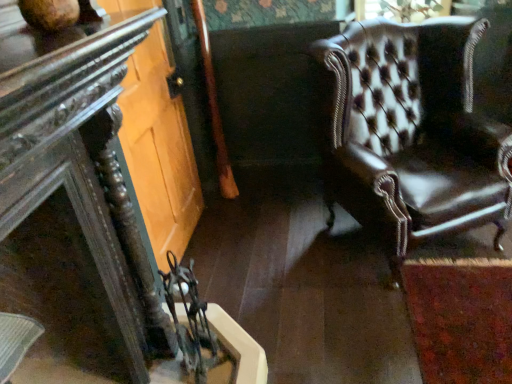
The width and height of the screenshot is (512, 384). Find the location of `clear glass door at lower left`. clear glass door at lower left is located at coordinates (159, 149).

Can you confirm if dark wood table at left is shorter than leather armchair at right?

Yes, dark wood table at left is shorter than leather armchair at right.

Is point (24, 107) closer to camera compared to point (435, 193)?

Yes.

Is dark wood table at left positioned beyond the bounds of leather armchair at right?

That's correct, dark wood table at left is outside of leather armchair at right.

Which is closer to the camera, (163,116) or (331,110)?

The point (331,110) is closer to the camera.

Would you say clear glass door at lower left is inside or outside leather armchair at right?

clear glass door at lower left is located beyond the bounds of leather armchair at right.

In the scene shown: Is clear glass door at lower left positioned in front of leather armchair at right?

Yes.

Is clear glass door at lower left at the right side of leather armchair at right?

Incorrect, clear glass door at lower left is not on the right side of leather armchair at right.

Which of these two, leather armchair at right or clear glass door at lower left, stands taller?

clear glass door at lower left.

Considering the positions of objects leather armchair at right and clear glass door at lower left in the image provided, who is behind, leather armchair at right or clear glass door at lower left?

leather armchair at right is behind.

Considering the sizes of objects leather armchair at right and clear glass door at lower left in the image provided, who is wider, leather armchair at right or clear glass door at lower left?

Wider between the two is leather armchair at right.

From a real-world perspective, is leather armchair at right positioned under clear glass door at lower left based on gravity?

Yes.

Would you say leather armchair at right is a long distance from dark wood table at left?

leather armchair at right is far away from dark wood table at left.

Is point (373, 48) positioned before point (17, 95)?

No, (373, 48) is behind (17, 95).

Where is `table above the leather armchair at right (from a real-world perspective)`? This screenshot has height=384, width=512. table above the leather armchair at right (from a real-world perspective) is located at coordinates (82, 170).

Considering the relative sizes of leather armchair at right and dark wood table at left in the image provided, is leather armchair at right shorter than dark wood table at left?

No.

You are a GUI agent. You are given a task and a screenshot of the screen. Output one action in this format:
    pyautogui.click(x=<x>, y=<y>)
    Task: Click on the glass door behind the dark wood table at left
    
    Given the screenshot: What is the action you would take?
    pyautogui.click(x=159, y=149)

Can you confirm if dark wood table at left is wider than clear glass door at lower left?

Indeed, dark wood table at left has a greater width compared to clear glass door at lower left.

From the image's perspective, is dark wood table at left positioned above or below clear glass door at lower left?

Clearly, from the image's perspective, dark wood table at left is below clear glass door at lower left.

Is clear glass door at lower left looking in the opposite direction of dark wood table at left?

That's not correct — clear glass door at lower left is not looking away from dark wood table at left.

Is clear glass door at lower left at the left side of dark wood table at left?

In fact, clear glass door at lower left is to the right of dark wood table at left.

Considering the sizes of clear glass door at lower left and dark wood table at left in the image, is clear glass door at lower left bigger or smaller than dark wood table at left?

In the image, clear glass door at lower left appears to be larger than dark wood table at left.

At what (x,y) coordinates should I click in order to perform the action: click on chair above the dark wood table at left (from the image's perspective). Please return your answer as a coordinate pair (x, y). Image resolution: width=512 pixels, height=384 pixels. Looking at the image, I should click on [410, 131].

This screenshot has height=384, width=512. Identify the location of glass door that is in front of the leather armchair at right. (159, 149).

From the image, which object appears to be farther from leather armchair at right, clear glass door at lower left or dark wood table at left?

Based on the image, dark wood table at left appears to be further to leather armchair at right.

Consider the image. Looking at the image, which one is located further to leather armchair at right, dark wood table at left or clear glass door at lower left?

dark wood table at left lies further to leather armchair at right than the other object.

Estimate the real-world distances between objects in this image. Which object is further from dark wood table at left, clear glass door at lower left or leather armchair at right?

Based on the image, leather armchair at right appears to be further to dark wood table at left.

Considering their positions, is leather armchair at right positioned closer to dark wood table at left than clear glass door at lower left?

clear glass door at lower left is positioned closer to the anchor dark wood table at left.

Considering their positions, is dark wood table at left positioned closer to clear glass door at lower left than leather armchair at right?

dark wood table at left is closer to clear glass door at lower left.

Which object lies nearer to the anchor point clear glass door at lower left, leather armchair at right or dark wood table at left?

dark wood table at left is positioned closer to the anchor clear glass door at lower left.

The width and height of the screenshot is (512, 384). Identify the location of glass door located between dark wood table at left and leather armchair at right in the left-right direction. (159, 149).